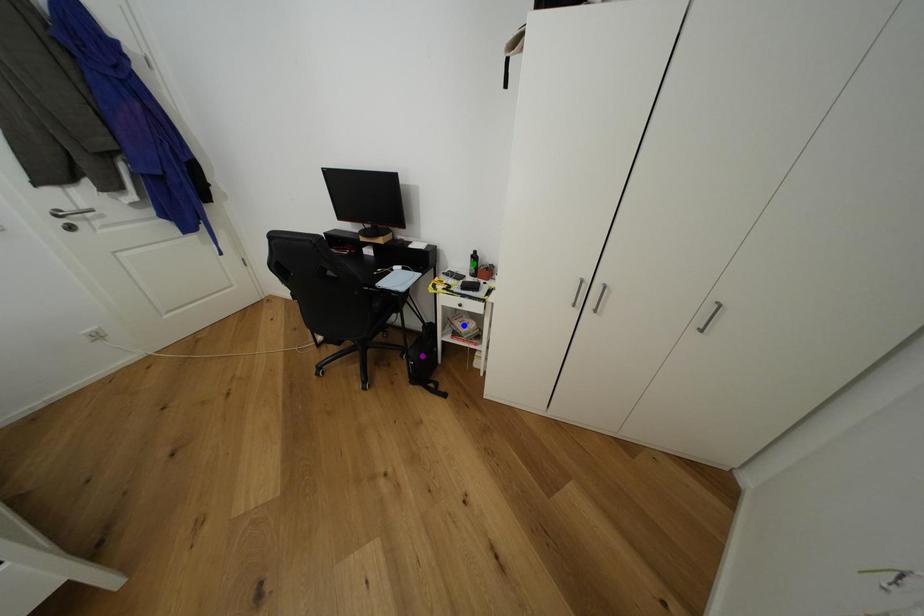
Order these from nearest to farthest:
- blue point
- purple point
- green point

green point → blue point → purple point